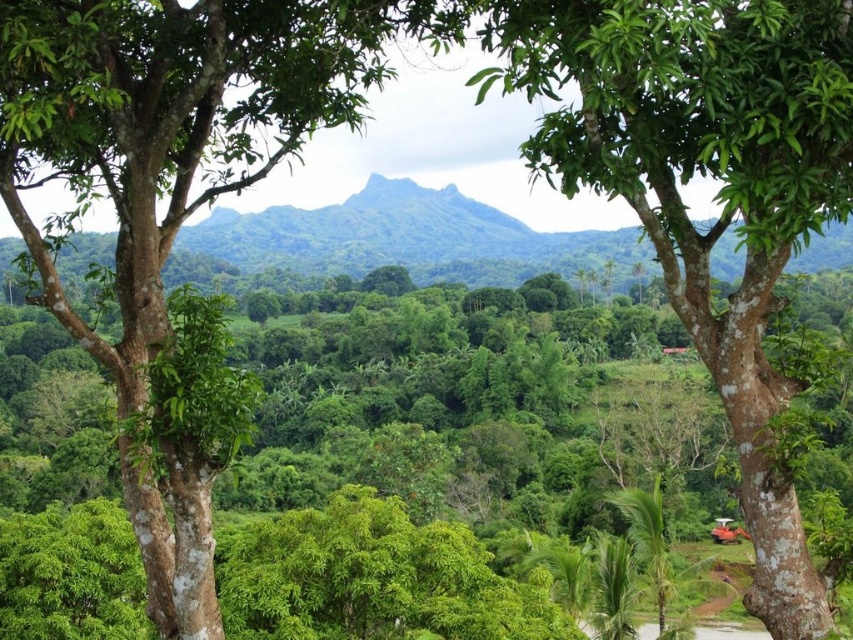
Question: Among these objects, which one is farthest from the camera?

Choices:
 (A) green rough bark tree at center
 (B) smooth brown tree trunk at left

Answer: (B)

Question: Which object is farther from the camera taking this photo?

Choices:
 (A) smooth brown tree trunk at left
 (B) green rough bark tree at center

Answer: (A)

Question: Does smooth brown tree trunk at left have a lesser width compared to green rough bark tree at center?

Choices:
 (A) yes
 (B) no

Answer: (B)

Question: Can you confirm if smooth brown tree trunk at left is wider than green rough bark tree at center?

Choices:
 (A) no
 (B) yes

Answer: (B)

Question: Which point appears farthest from the camera in this image?

Choices:
 (A) (120, 296)
 (B) (666, 132)

Answer: (A)

Question: Is smooth brown tree trunk at left wider than green rough bark tree at center?

Choices:
 (A) yes
 (B) no

Answer: (A)